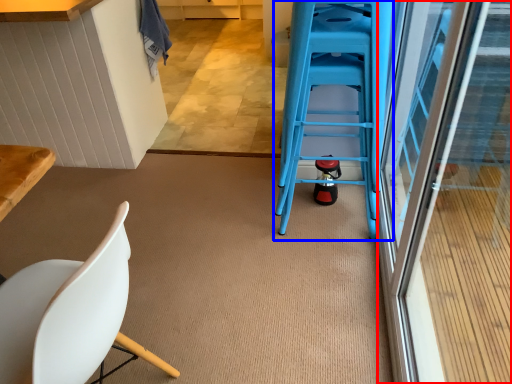
Question: Among these objects, which one is farthest to the camera, screen door (highlighted by a red box) or ladder (highlighted by a blue box)?

Choices:
 (A) screen door
 (B) ladder

Answer: (B)